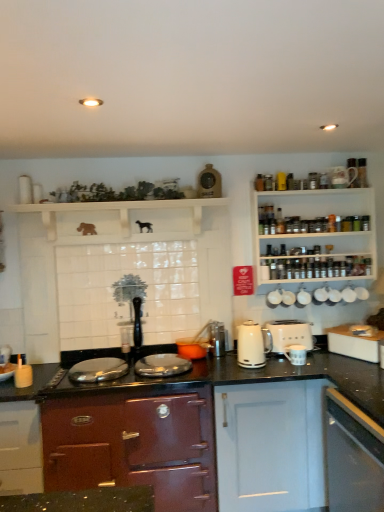
Find the location of a particular element. free spot above white wooden spice rack at upper right (from a real-world perspective) is located at coordinates (318, 175).